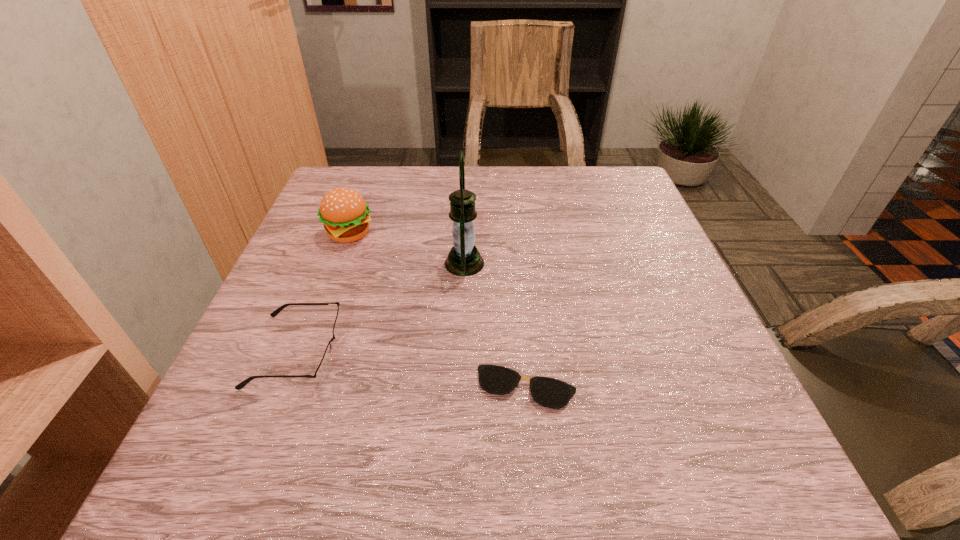
This screenshot has height=540, width=960. What are the coordinates of `hamburger situated at the left edge` in the screenshot? It's located at (345, 214).

Find the location of `spectacles that is at the left edge`. spectacles that is at the left edge is located at coordinates (324, 366).

Locate an element on the screen. blank area at the far edge is located at coordinates (572, 191).

Where is `blank space at the near edge of the desktop`? The width and height of the screenshot is (960, 540). blank space at the near edge of the desktop is located at coordinates (527, 465).

The width and height of the screenshot is (960, 540). I want to click on vacant space at the left edge of the desktop, so click(x=282, y=357).

Find the location of `free space at the right edge of the desktop`. free space at the right edge of the desktop is located at coordinates (632, 292).

In the image, there is a desktop. At what (x,y) coordinates should I click in order to perform the action: click on free space at the far left corner. Please return your answer as a coordinate pair (x, y). The image size is (960, 540). Looking at the image, I should click on (335, 181).

The height and width of the screenshot is (540, 960). What are the coordinates of `vacant area at the near left corner` in the screenshot? It's located at (242, 491).

Locate an element on the screen. This screenshot has width=960, height=540. free space at the far right corner of the desktop is located at coordinates (635, 200).

At what (x,y) coordinates should I click in order to perform the action: click on vacant space that is in between the right spectacles and the second shortest object. Please return your answer as a coordinate pair (x, y). Looking at the image, I should click on (412, 369).